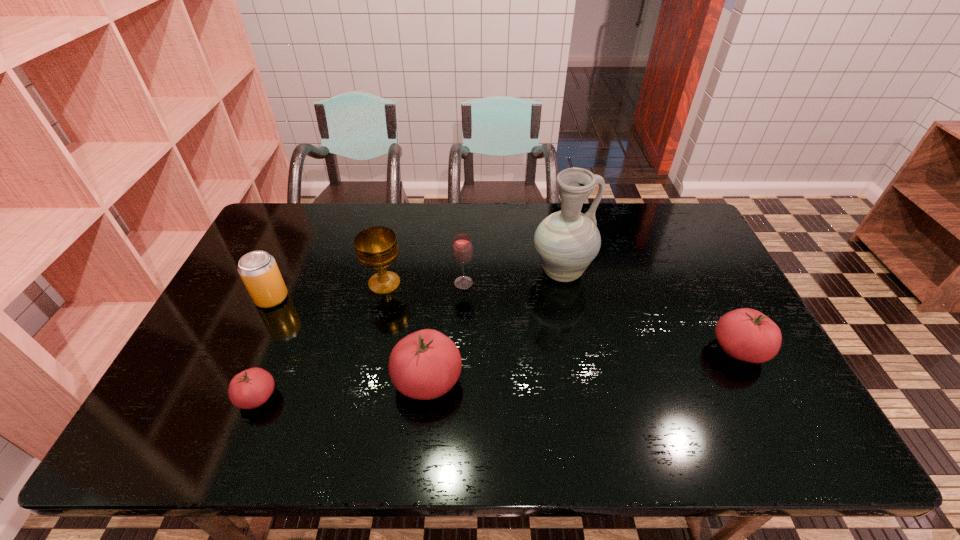
Find the location of `vacant spot for a new tomato to ensure equal spacing`. vacant spot for a new tomato to ensure equal spacing is located at coordinates (588, 364).